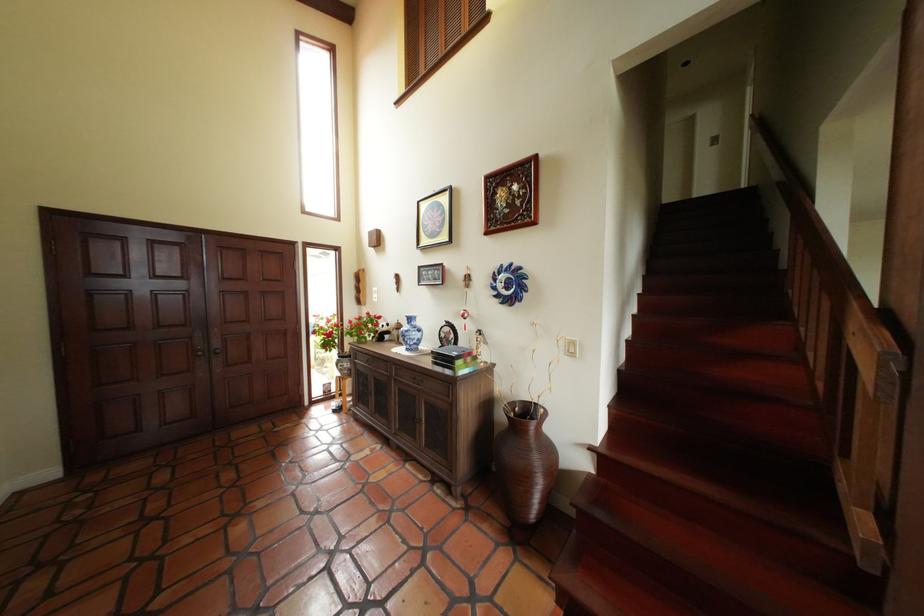
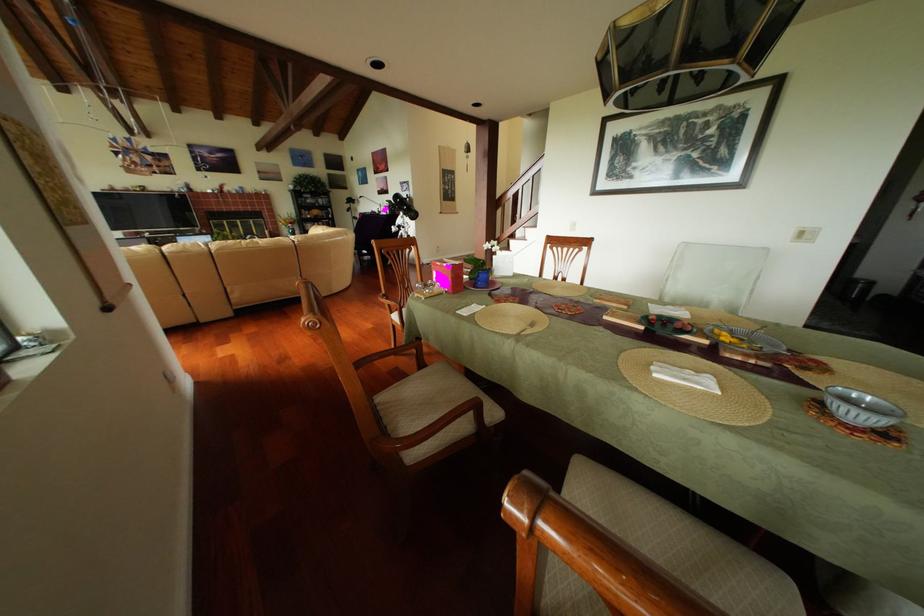
Question: I am providing you with two images of the same scene from different viewpoints. Which of the following objects are not visible in image2?

Choices:
 (A) green paper sheet
 (B) metal fork
 (C) small black box
 (D) wooden chair armrest

Answer: (C)